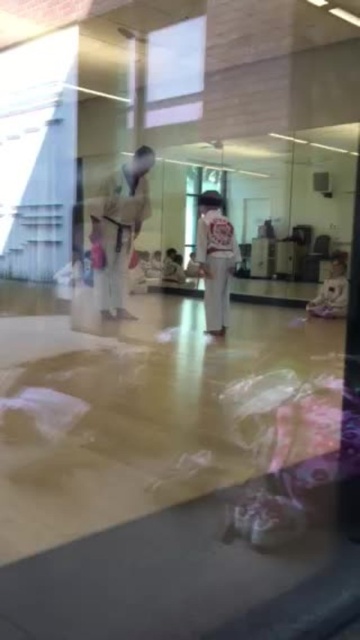
From the picture: Does white cotton karate uniform at center have a smaller size compared to white cotton shirt at right?

Correct, white cotton karate uniform at center occupies less space than white cotton shirt at right.

What do you see at coordinates (214, 259) in the screenshot? I see `white cotton karate uniform at center` at bounding box center [214, 259].

Where is `white cotton karate uniform at center`? Image resolution: width=360 pixels, height=640 pixels. white cotton karate uniform at center is located at coordinates (214, 259).

Is white karate uniform at center wider than white cotton karate uniform at center?

Yes, white karate uniform at center is wider than white cotton karate uniform at center.

Is white karate uniform at center above white cotton karate uniform at center?

Indeed, white karate uniform at center is positioned over white cotton karate uniform at center.

Find the location of a particular element. white karate uniform at center is located at coordinates (119, 230).

Between white karate uniform at center and white cotton shirt at right, which one is positioned lower?

white cotton shirt at right

Is point (141, 177) closer to viewer compared to point (340, 275)?

Yes, point (141, 177) is in front of point (340, 275).

In order to click on white karate uniform at center in this screenshot , I will do `click(119, 230)`.